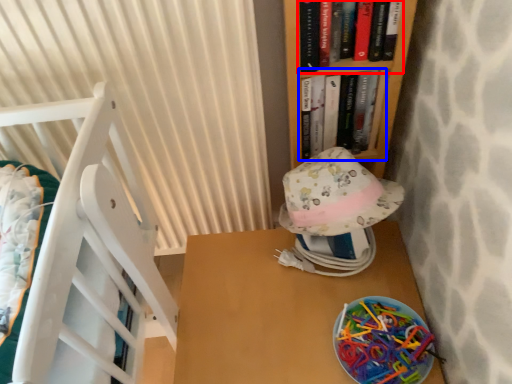
Question: Which object is further to the camera taking this photo, book (highlighted by a red box) or book (highlighted by a blue box)?

Choices:
 (A) book
 (B) book

Answer: (B)